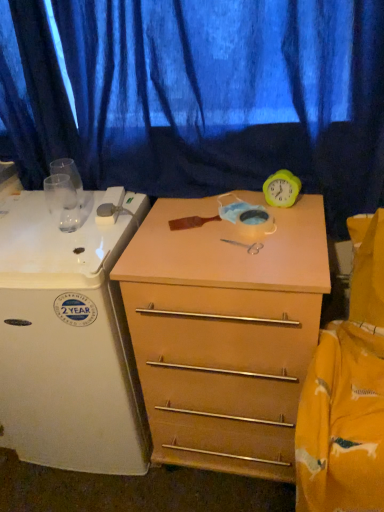
Question: Should I look upward or downward to see yellow rubber clock at upper right?

Choices:
 (A) up
 (B) down

Answer: (A)

Question: From a real-world perspective, is yellow rubber clock at upper right under light wood/finish chest of drawers at center?

Choices:
 (A) no
 (B) yes

Answer: (A)

Question: Are yellow rubber clock at upper right and light wood/finish chest of drawers at center making contact?

Choices:
 (A) no
 (B) yes

Answer: (A)

Question: Is light wood/finish chest of drawers at center completely or partially inside yellow rubber clock at upper right?

Choices:
 (A) no
 (B) yes

Answer: (A)

Question: Is yellow rubber clock at upper right at the right side of light wood/finish chest of drawers at center?

Choices:
 (A) yes
 (B) no

Answer: (A)

Question: Is yellow rubber clock at upper right looking in the opposite direction of light wood/finish chest of drawers at center?

Choices:
 (A) yes
 (B) no

Answer: (B)

Question: From the image's perspective, is yellow rubber clock at upper right under light wood/finish chest of drawers at center?

Choices:
 (A) yes
 (B) no

Answer: (B)

Question: Considering the relative sizes of light wood/finish chest of drawers at center and white glossy refrigerator at left in the image provided, is light wood/finish chest of drawers at center smaller than white glossy refrigerator at left?

Choices:
 (A) yes
 (B) no

Answer: (A)

Question: Is light wood/finish chest of drawers at center outside white glossy refrigerator at left?

Choices:
 (A) yes
 (B) no

Answer: (A)

Question: Are light wood/finish chest of drawers at center and white glossy refrigerator at left far apart?

Choices:
 (A) no
 (B) yes

Answer: (A)

Question: Considering the relative positions of light wood/finish chest of drawers at center and white glossy refrigerator at left in the image provided, is light wood/finish chest of drawers at center to the right of white glossy refrigerator at left from the viewer's perspective?

Choices:
 (A) no
 (B) yes

Answer: (B)

Question: Considering the relative sizes of light wood/finish chest of drawers at center and white glossy refrigerator at left in the image provided, is light wood/finish chest of drawers at center thinner than white glossy refrigerator at left?

Choices:
 (A) yes
 (B) no

Answer: (A)

Question: From a real-world perspective, is light wood/finish chest of drawers at center under white glossy refrigerator at left?

Choices:
 (A) no
 (B) yes

Answer: (B)

Question: Is blue fabric curtain at upper center facing away from light wood/finish chest of drawers at center?

Choices:
 (A) yes
 (B) no

Answer: (B)